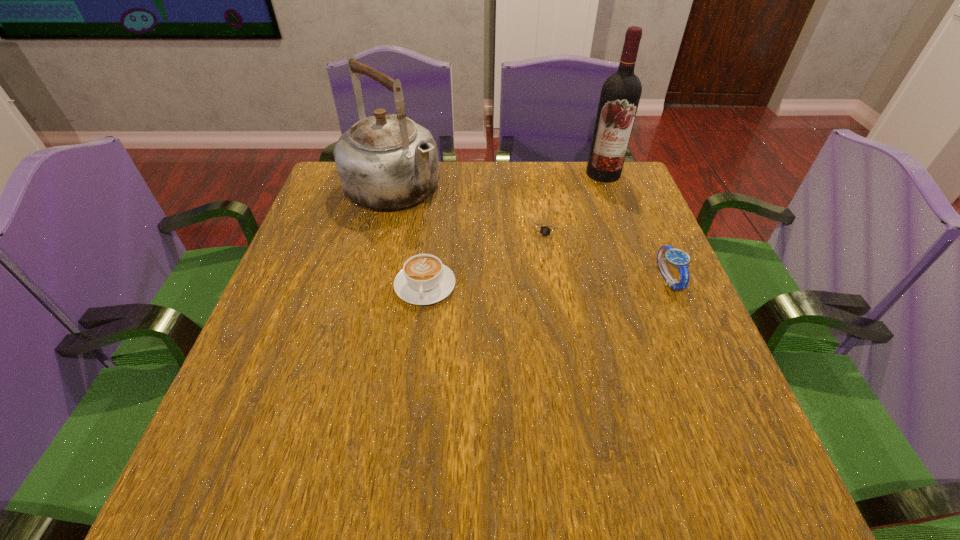
The width and height of the screenshot is (960, 540). In order to click on free area in between the third object from left to right and the tallest object in this screenshot , I will do `click(576, 202)`.

The height and width of the screenshot is (540, 960). Find the location of `free point between the tallest object and the kettle`. free point between the tallest object and the kettle is located at coordinates (498, 182).

Find the location of a particular element. Image resolution: width=960 pixels, height=540 pixels. free space between the second tallest object and the shortest object is located at coordinates (470, 211).

The height and width of the screenshot is (540, 960). Identify the location of free spot between the second tallest object and the third object from left to right. (470, 211).

I want to click on vacant area that lies between the second tallest object and the second shortest object, so [409, 238].

Where is `free area in between the second shortest object and the taller watch`? free area in between the second shortest object and the taller watch is located at coordinates (546, 282).

Find the location of a particular element. free area in between the cappuccino and the kettle is located at coordinates (409, 238).

I want to click on blank region between the taller watch and the cappuccino, so pos(546,282).

Where is `free space between the taller watch and the tallest object`? free space between the taller watch and the tallest object is located at coordinates (636, 226).

Select which object is the third closest to the farther watch. Please provide its 2D coordinates. Your answer should be formatted as a tuple, i.e. [(x, y)], where the tuple contains the x and y coordinates of a point satisfying the conditions above.

[(424, 280)]